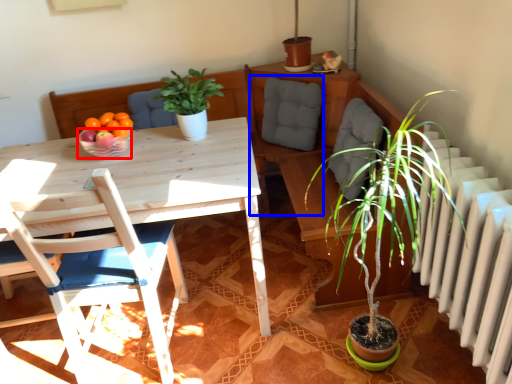
Question: Which of the following is the closest to the observer, bowl (highlighted by a red box) or swivel chair (highlighted by a blue box)?

Choices:
 (A) bowl
 (B) swivel chair

Answer: (A)